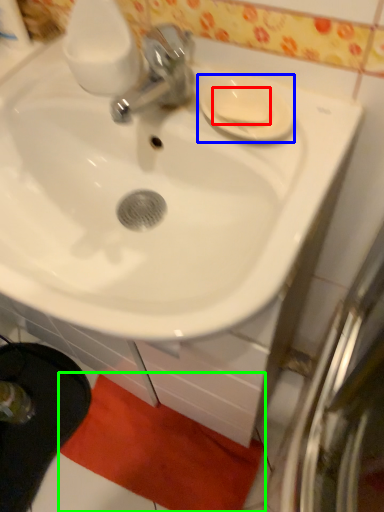
Question: Estimate the real-world distances between objects in this image. Which object is closer to soap (highlighted by a red box), saucer (highlighted by a blue box) or bath mat (highlighted by a green box)?

Choices:
 (A) saucer
 (B) bath mat

Answer: (A)